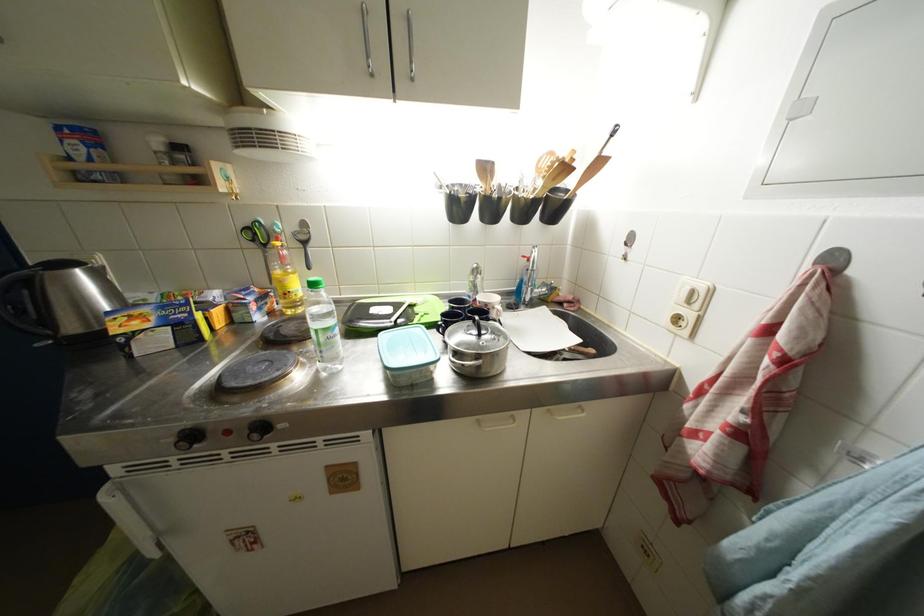
Find where to lift the kettle handle. Please return your answer as a coordinate pair (x, y).

(10, 276)